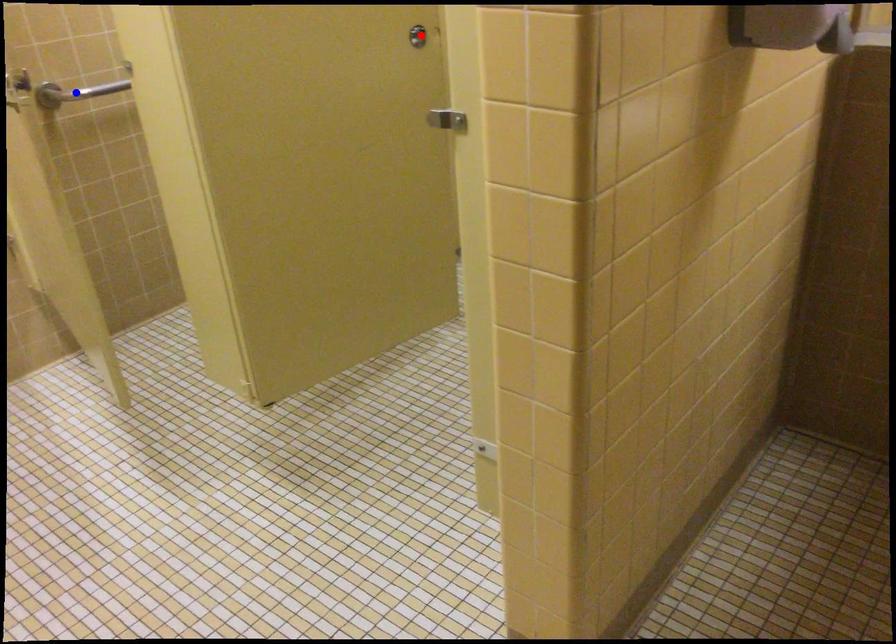
Question: Two points are marked on the image. Which point is closer to the camera?

Choices:
 (A) Blue point is closer.
 (B) Red point is closer.

Answer: (B)